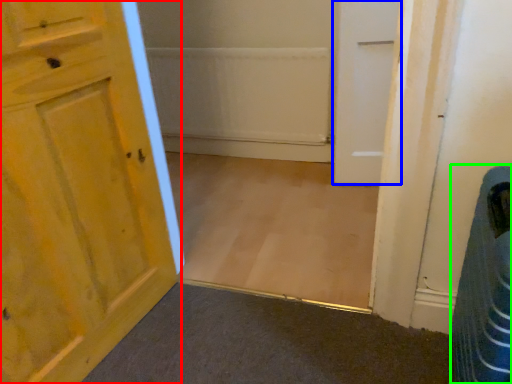
Question: Based on their relative distances, which object is nearer to door (highlighted by a red box)? Choose from door (highlighted by a blue box) and laundry basket (highlighted by a green box).

Choices:
 (A) door
 (B) laundry basket

Answer: (B)